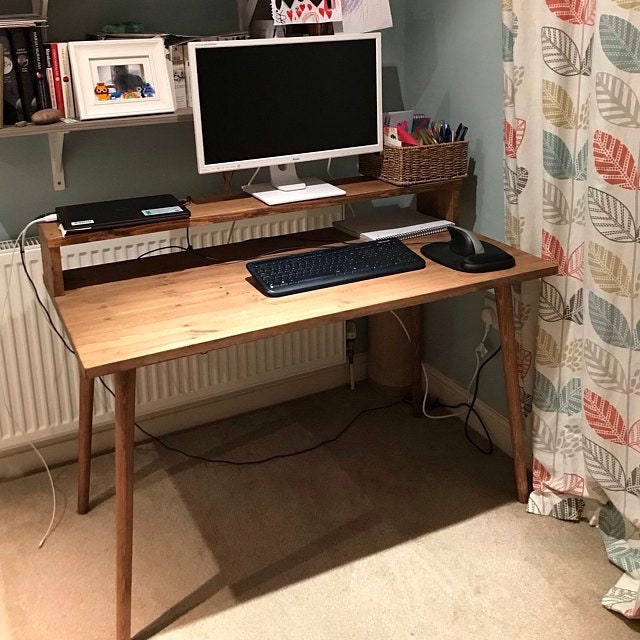
Identify the location of mouse. The height and width of the screenshot is (640, 640). (468, 246).